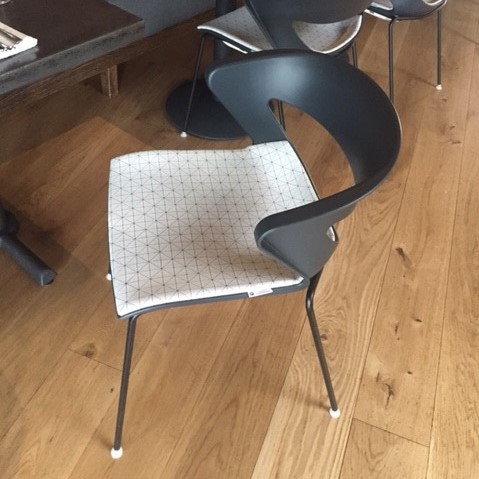
Identify the location of item on desk. The height and width of the screenshot is (479, 479). (11, 38).